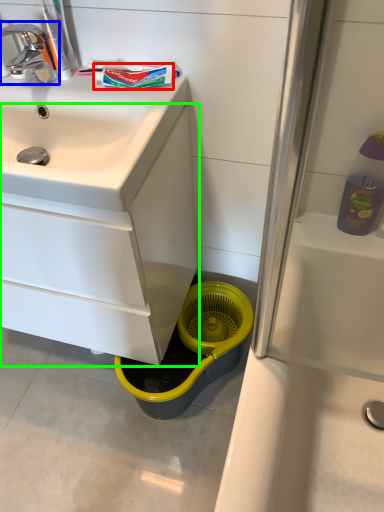
Question: Based on their relative distances, which object is nearer to toothpaste (highlighted by a red box)? Choose from tap (highlighted by a blue box) and bathroom cabinet (highlighted by a green box).

Choices:
 (A) tap
 (B) bathroom cabinet

Answer: (A)